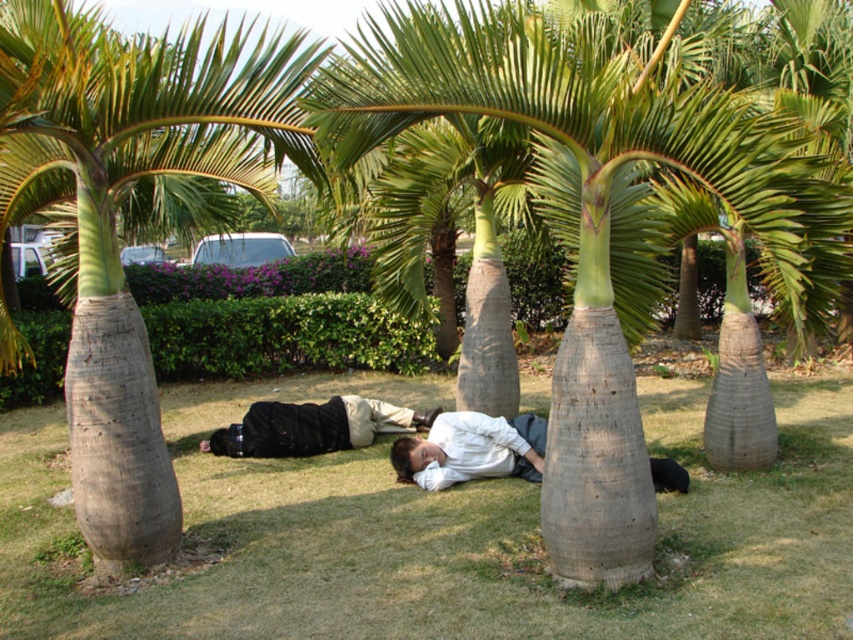
Question: Which object is farther from the camera taking this photo?

Choices:
 (A) black matte shirt at center
 (B) smooth gray trunk at left
 (C) green grass at center
 (D) white matte shirt at center

Answer: (A)

Question: Can you confirm if green grass at center is positioned to the left of white matte shirt at center?

Choices:
 (A) no
 (B) yes

Answer: (A)

Question: Is green grass at center smaller than white matte shirt at center?

Choices:
 (A) yes
 (B) no

Answer: (A)

Question: Estimate the real-world distances between objects in this image. Which object is closer to the smooth gray trunk at left?

Choices:
 (A) black matte shirt at center
 (B) white matte shirt at center
 (C) smooth gray trunk at center
 (D) green grass at center

Answer: (C)

Question: Can you confirm if green grass at center is positioned below white matte shirt at center?

Choices:
 (A) no
 (B) yes

Answer: (B)

Question: Which object is positioned closest to the black matte shirt at center?

Choices:
 (A) green grass at center
 (B) white matte shirt at center
 (C) smooth gray trunk at center

Answer: (B)